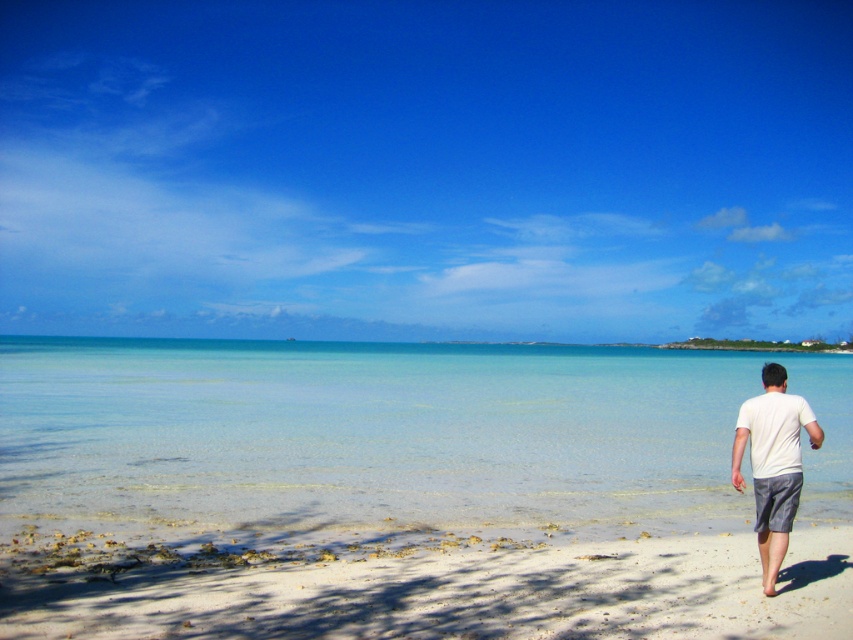
You are standing at the point marked as point at [685,573]. You want to walk to the water. The distance between you and the water is 8.01 meters. If you walk at a speed of 1.5 meters per second, how many seconds will it take you to reach the water?

The distance between the point at [685,573] and the water is 8.01 meters. At a speed of 1.5 meters per second, it will take 8.01 divided by 1.5, which equals approximately 5.34 seconds to reach the water.

Based on the photo, you are standing on the beach and see two points marked on the sand. The first point is at coordinates point (505, 504) and the second is at point (764, 493). Which point is closer to you?

Point (505, 504) is closer to you because it is further to the viewer than point (764, 493).